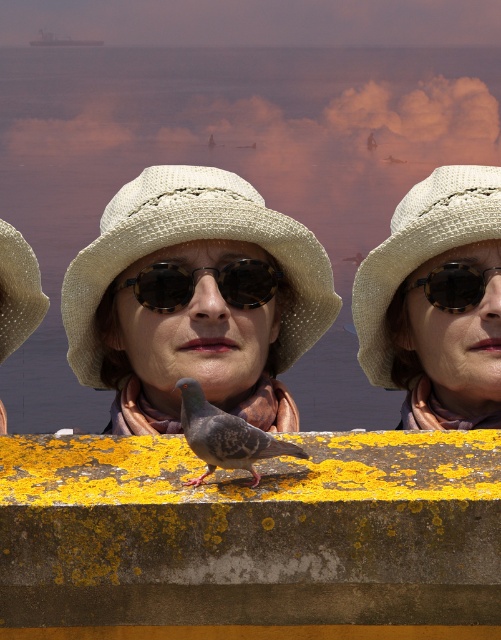
Who is more forward, (151, 168) or (464, 300)?

Point (464, 300)

Is white woven hat at center to the right of tortoiseshell plastic goggles at center from the viewer's perspective?

In fact, white woven hat at center is to the left of tortoiseshell plastic goggles at center.

The width and height of the screenshot is (501, 640). I want to click on white woven hat at center, so click(x=189, y=241).

Where is `natural straw hat at center`? The height and width of the screenshot is (640, 501). natural straw hat at center is located at coordinates (420, 248).

Does natural straw hat at center lie behind beige straw hat at center?

No, it is not.

Does point (415, 186) come behind point (40, 317)?

Yes.

Identify the location of natural straw hat at center. Image resolution: width=501 pixels, height=640 pixels. (420, 248).

Which is above, natural straw hat at center or tortoiseshell sunglasses at center?

Positioned higher is natural straw hat at center.

In order to click on natural straw hat at center in this screenshot , I will do `click(420, 248)`.